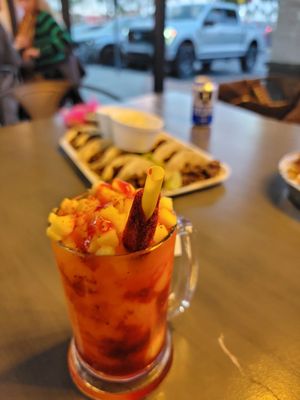
The height and width of the screenshot is (400, 300). Identify the location of table. (241, 301).